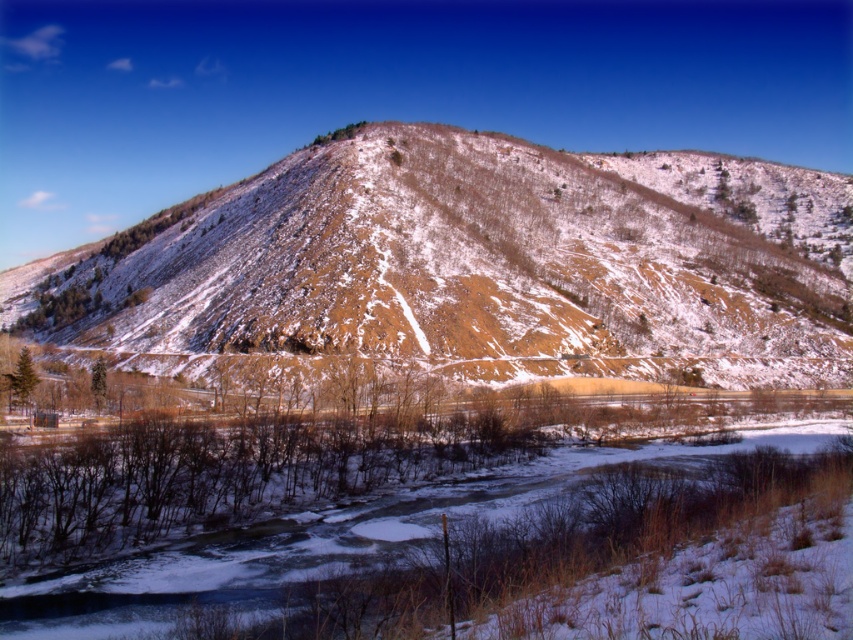
Which is above, brown textured mountain at center or white snowy river at lower center?

Positioned higher is brown textured mountain at center.

Between brown textured mountain at center and white snowy river at lower center, which one appears on the right side from the viewer's perspective?

brown textured mountain at center

Where is `brown textured mountain at center`? brown textured mountain at center is located at coordinates (474, 264).